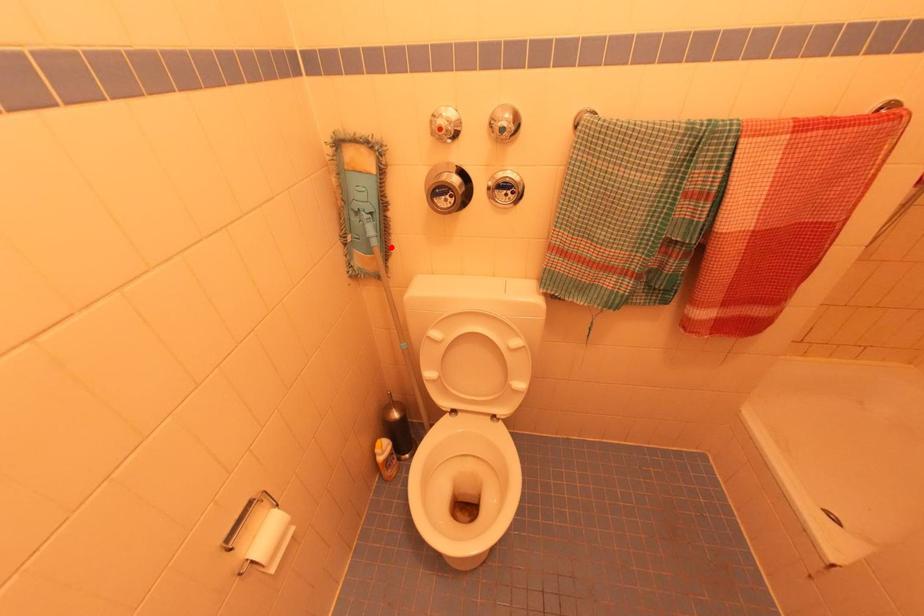
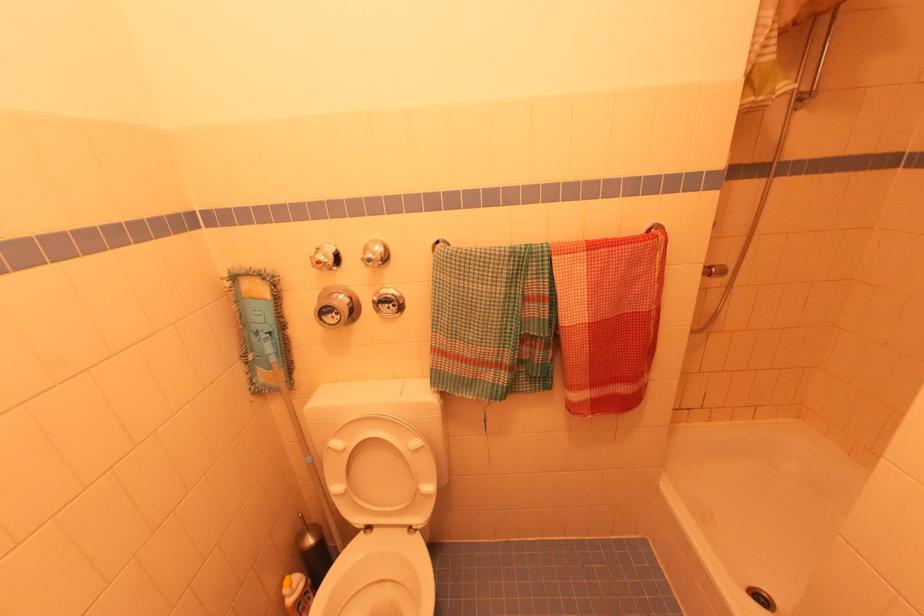
The point at the highlighted location is marked in the first image. Where is the corresponding point in the second image?

(293, 361)